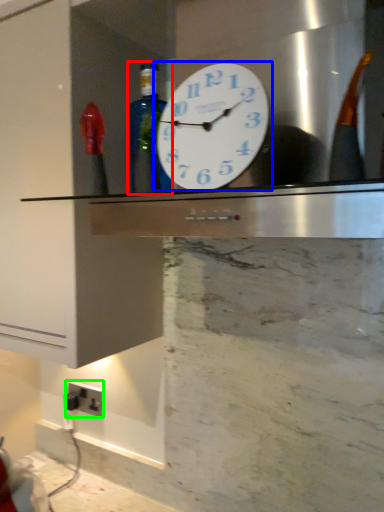
Question: Which object is positioned closest to bottle (highlighted by a red box)? Select from wall clock (highlighted by a blue box) and electric outlet (highlighted by a green box).

Choices:
 (A) wall clock
 (B) electric outlet

Answer: (A)